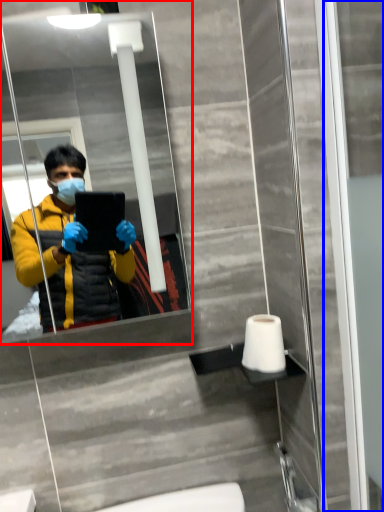
Question: Which object appears farthest to the camera in this image, mirror (highlighted by a red box) or screen door (highlighted by a blue box)?

Choices:
 (A) mirror
 (B) screen door

Answer: (A)